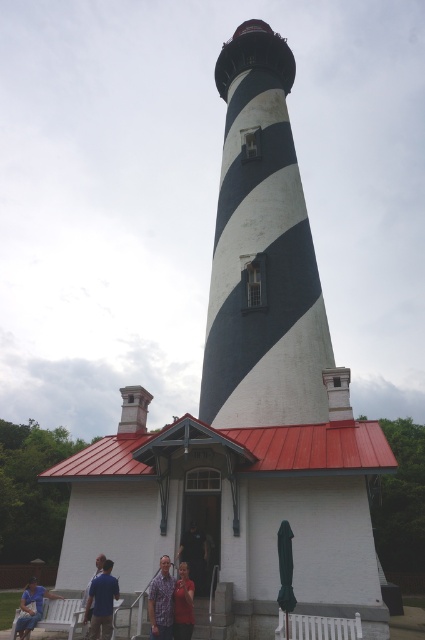
Question: Does white painted wood park bench at lower center have a greater width compared to light brown wood shirt at center?

Choices:
 (A) yes
 (B) no

Answer: (A)

Question: Which object is closer to the camera taking this photo?

Choices:
 (A) blue shirt at center
 (B) light brown wood shirt at center

Answer: (B)

Question: Which point is farther to the camera?

Choices:
 (A) printed cotton shirt at lower center
 (B) blue shirt at center
 (C) blue shirt at lower left

Answer: (B)

Question: Does printed cotton shirt at lower center lie in front of light brown wood shirt at center?

Choices:
 (A) yes
 (B) no

Answer: (B)

Question: Which point is closer to the camera?

Choices:
 (A) (150, 596)
 (B) (116, 586)

Answer: (A)

Question: Observing the image, what is the correct spatial positioning of printed cotton shirt at lower center in reference to light brown wood shirt at center?

Choices:
 (A) above
 (B) below

Answer: (A)